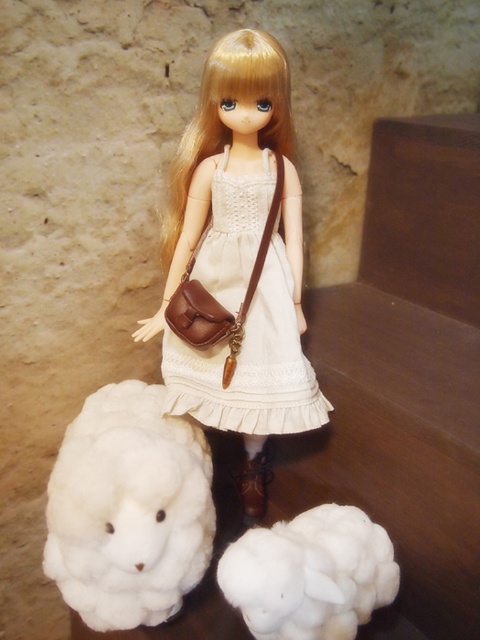
Find the location of a particular element. matte brown purse at center is located at coordinates (239, 253).

Can you confirm if matte brown purse at center is thinner than white lace dress at center?

No.

Image resolution: width=480 pixels, height=640 pixels. Describe the element at coordinates (239, 253) in the screenshot. I see `matte brown purse at center` at that location.

The height and width of the screenshot is (640, 480). In order to click on matte brown purse at center in this screenshot , I will do `click(239, 253)`.

Which is above, white lace dress at center or brown leather boot at lower center?

white lace dress at center is higher up.

Does white lace dress at center have a lesser width compared to brown leather boot at lower center?

No, white lace dress at center is not thinner than brown leather boot at lower center.

Where is `white lace dress at center`? This screenshot has width=480, height=640. white lace dress at center is located at coordinates (251, 365).

Who is higher up, matte brown purse at center or white fluffy sheep at lower left?

Positioned higher is matte brown purse at center.

Is point (193, 154) positioned after point (324, 524)?

That is True.

You are a GUI agent. You are given a task and a screenshot of the screen. Output one action in this format:
    pyautogui.click(x=<x>, y=<y>)
    Task: Click on the matte brown purse at center
    This screenshot has width=480, height=640.
    Given the screenshot: What is the action you would take?
    pyautogui.click(x=239, y=253)